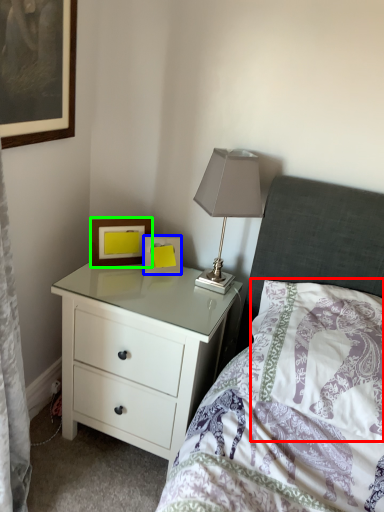
Question: Estimate the real-world distances between objects in this image. Which object is closer to pillow (highlighted by a red box), picture frame (highlighted by a blue box) or picture frame (highlighted by a green box)?

Choices:
 (A) picture frame
 (B) picture frame

Answer: (A)